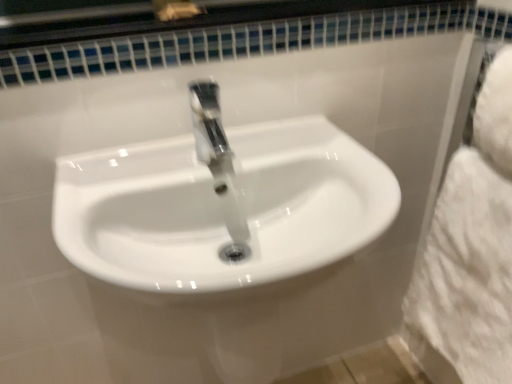
Where is `white fluffy bath towel at right`? white fluffy bath towel at right is located at coordinates (470, 253).

The image size is (512, 384). Describe the element at coordinates (470, 253) in the screenshot. I see `white fluffy bath towel at right` at that location.

This screenshot has height=384, width=512. What do you see at coordinates (221, 204) in the screenshot?
I see `white glossy sink at center` at bounding box center [221, 204].

Find the location of a particular element. Image resolution: width=512 pixels, height=384 pixels. white glossy sink at center is located at coordinates (221, 204).

This screenshot has width=512, height=384. Find the location of `white fluffy bath towel at right`. white fluffy bath towel at right is located at coordinates (470, 253).

Considering the relative positions of white glossy sink at center and white fluffy bath towel at right in the image provided, is white glossy sink at center to the left of white fluffy bath towel at right from the viewer's perspective?

Yes, white glossy sink at center is to the left of white fluffy bath towel at right.

Considering the relative positions of white glossy sink at center and white fluffy bath towel at right in the image provided, is white glossy sink at center behind white fluffy bath towel at right?

That is False.

Does point (342, 195) come behind point (423, 347)?

No, it is in front of (423, 347).

From the image's perspective, would you say white glossy sink at center is positioned over white fluffy bath towel at right?

No, from the image's perspective, white glossy sink at center is not on top of white fluffy bath towel at right.

From a real-world perspective, between white glossy sink at center and white fluffy bath towel at right, who is vertically higher?

In real-world perspective, white glossy sink at center is above.

Considering the sizes of objects white glossy sink at center and white fluffy bath towel at right in the image provided, who is wider, white glossy sink at center or white fluffy bath towel at right?

white glossy sink at center.

In terms of height, does white glossy sink at center look taller or shorter compared to white fluffy bath towel at right?

Considering their sizes, white glossy sink at center has less height than white fluffy bath towel at right.

Does white glossy sink at center have a smaller size compared to white fluffy bath towel at right?

Actually, white glossy sink at center might be larger than white fluffy bath towel at right.

Would you say white glossy sink at center is inside or outside white fluffy bath towel at right?

white glossy sink at center exists outside the volume of white fluffy bath towel at right.

Is white glossy sink at center not close to white fluffy bath towel at right?

white glossy sink at center is actually quite close to white fluffy bath towel at right.

Could you tell me if white glossy sink at center is turned towards white fluffy bath towel at right?

No, white glossy sink at center is not oriented towards white fluffy bath towel at right.

How different are the orientations of white glossy sink at center and white fluffy bath towel at right in degrees?

white glossy sink at center and white fluffy bath towel at right are facing 89.4 degrees away from each other.

You are a GUI agent. You are given a task and a screenshot of the screen. Output one action in this format:
    pyautogui.click(x=<x>, y=<y>)
    Task: Click on the bath towel behind the white glossy sink at center
    This screenshot has height=384, width=512.
    Given the screenshot: What is the action you would take?
    pyautogui.click(x=470, y=253)

In the image, is white fluffy bath towel at right on the left side or the right side of white glossy sink at center?

Clearly, white fluffy bath towel at right is on the right of white glossy sink at center in the image.

Between white fluffy bath towel at right and white glossy sink at center, which one is positioned behind?

white fluffy bath towel at right is further from the camera.

Does point (454, 244) lie behind point (314, 168)?

Yes, point (454, 244) is behind point (314, 168).

From the image's perspective, between white fluffy bath towel at right and white glossy sink at center, which one is located above?

A: From the image's view, white fluffy bath towel at right is above.

From a real-world perspective, between white fluffy bath towel at right and white glossy sink at center, who is vertically higher?

In real-world perspective, white glossy sink at center is above.

Between white fluffy bath towel at right and white glossy sink at center, which one has larger width?

white glossy sink at center is wider.

Is white fluffy bath towel at right shorter than white glossy sink at center?

No, white fluffy bath towel at right is not shorter than white glossy sink at center.

Is white fluffy bath towel at right bigger than white glossy sink at center?

Actually, white fluffy bath towel at right might be smaller than white glossy sink at center.

Is white fluffy bath towel at right spatially inside white glossy sink at center, or outside of it?

white fluffy bath towel at right lies outside white glossy sink at center.

Is white fluffy bath towel at right not close to white glossy sink at center?

Actually, white fluffy bath towel at right and white glossy sink at center are a little close together.

Is white fluffy bath towel at right oriented towards white glossy sink at center?

Yes, white fluffy bath towel at right faces towards white glossy sink at center.

Can you tell me how much white fluffy bath towel at right and white glossy sink at center differ in facing direction?

89.4 degrees.

Identify the location of bath towel behind the white glossy sink at center. This screenshot has width=512, height=384. (470, 253).

This screenshot has width=512, height=384. Find the location of `bath towel above the white glossy sink at center (from the image's perspective)`. bath towel above the white glossy sink at center (from the image's perspective) is located at coordinates (470, 253).

Identify the location of sink that appears below the white fluffy bath towel at right (from the image's perspective). [221, 204].